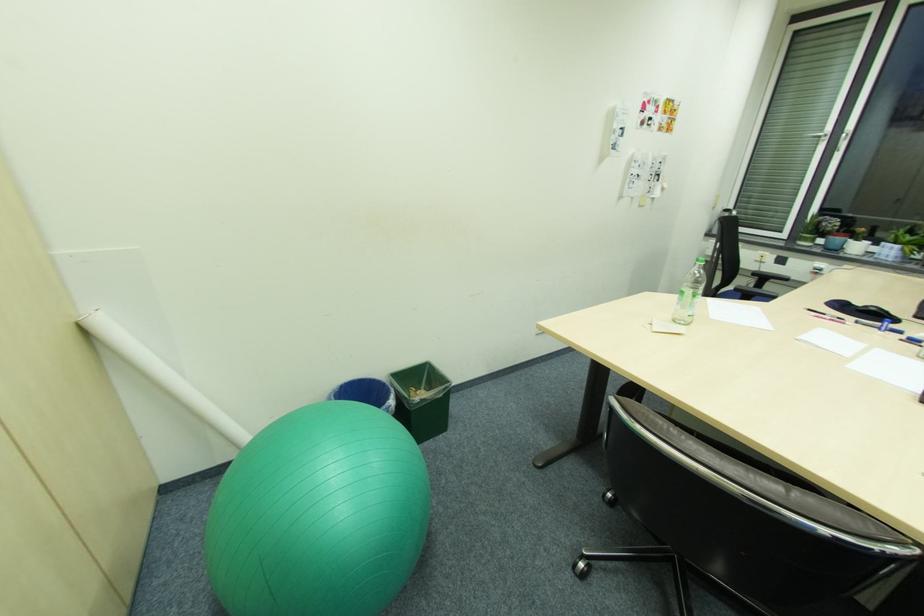
Find where to lift the black pouch. Please return your answer as a coordinate pair (x, y).

(861, 310)